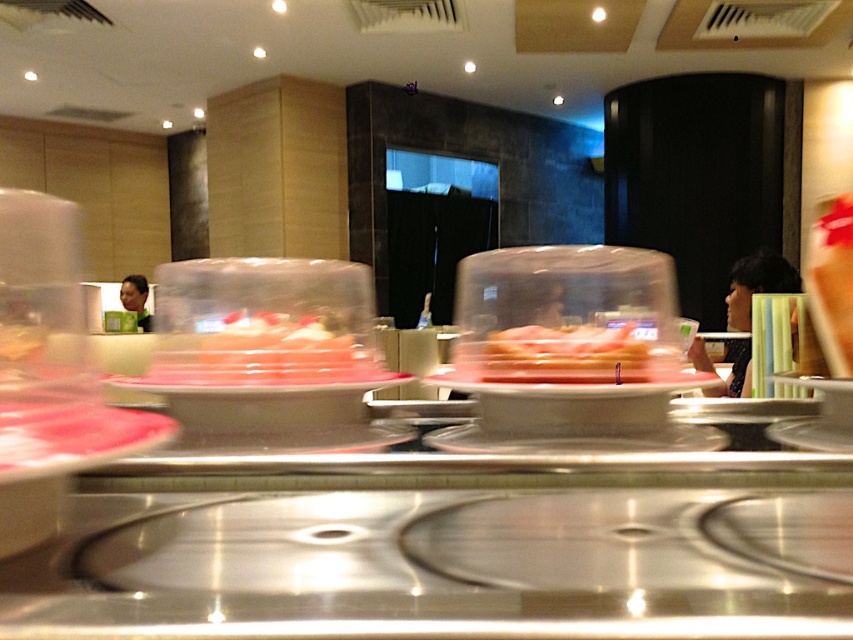
Question: Does pink translucent sushi at center lie behind clear plastic plate at center?

Choices:
 (A) no
 (B) yes

Answer: (B)

Question: Does pink translucent plastic at center have a greater width compared to clear plastic plate at center?

Choices:
 (A) no
 (B) yes

Answer: (A)

Question: Can you confirm if pink translucent plastic at center is smaller than clear plastic plate at center?

Choices:
 (A) no
 (B) yes

Answer: (B)

Question: Which point is closer to the camera taking this photo?

Choices:
 (A) (378, 380)
 (B) (547, 365)

Answer: (B)

Question: Which point is farther to the camera?

Choices:
 (A) (575, 340)
 (B) (335, 362)

Answer: (B)

Question: Which is farther from the pink translucent plastic at center?

Choices:
 (A) clear plastic plate at center
 (B) pink translucent sushi at center

Answer: (B)